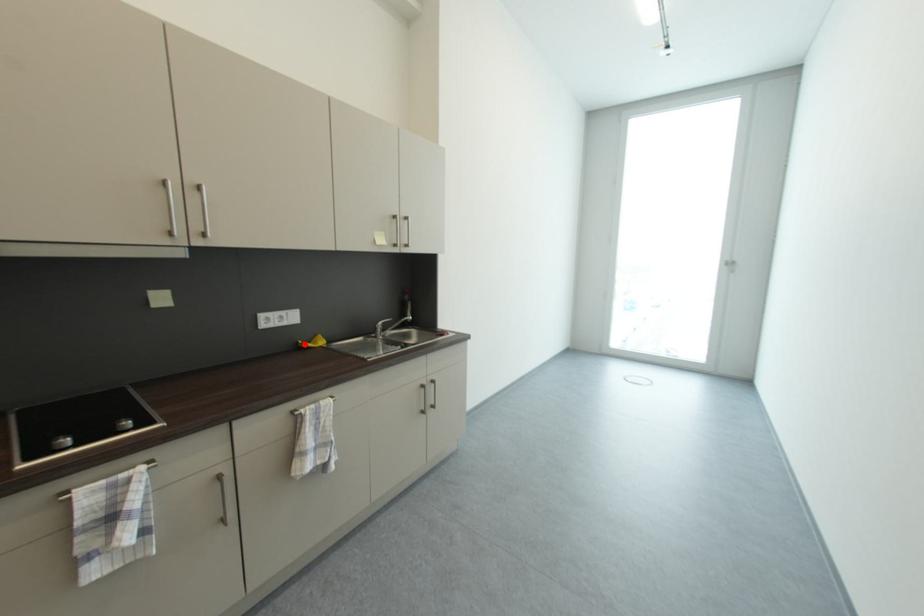
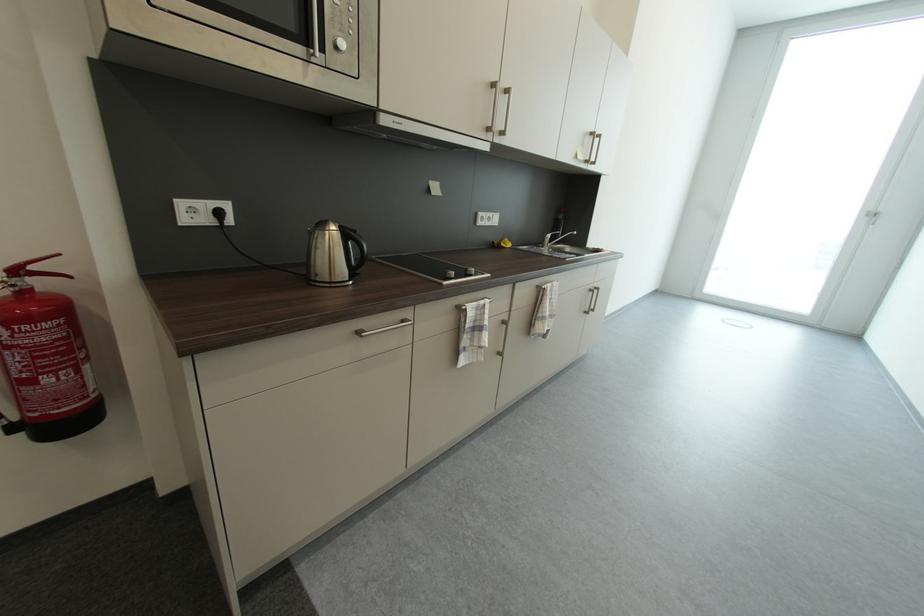
The point at the highlighted location is marked in the first image. Where is the corresponding point in the second image?

(501, 244)